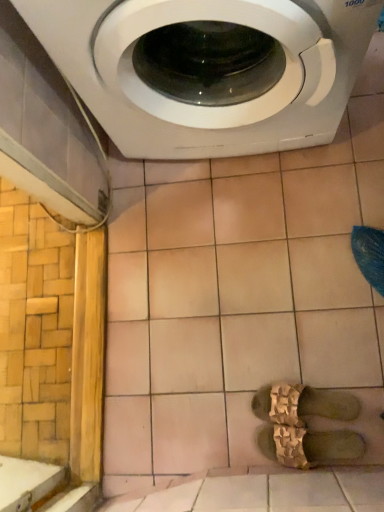
Question: From a real-world perspective, is beige ceramic tile at upper center positioned above or below gold textured sandals at center, which appears as the 2th shoe when ordered from the bottom?

Choices:
 (A) above
 (B) below

Answer: (B)

Question: Would you say beige ceramic tile at upper center is to the left or to the right of gold textured sandals at center, the first shoe when ordered from top to bottom, in the picture?

Choices:
 (A) right
 (B) left

Answer: (B)

Question: Which of these objects is positioned farthest from the beige ceramic tile at upper center?

Choices:
 (A) brown textured sandals at center, which is the 2th shoe in top-to-bottom order
 (B) white glossy washing machine at upper center
 (C) gold textured sandals at center, which appears as the 2th shoe when ordered from the bottom

Answer: (B)

Question: Based on their relative distances, which object is nearer to the white glossy washing machine at upper center?

Choices:
 (A) brown textured sandals at center, which is the 2th shoe in top-to-bottom order
 (B) beige ceramic tile at upper center
 (C) gold textured sandals at center, which appears as the 2th shoe when ordered from the bottom

Answer: (B)